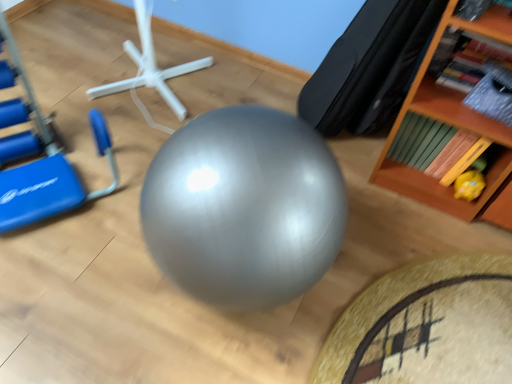
Question: From the image's perspective, is yellow rubber duck at lower right positioned above or below black leather bean bag chair at upper right?

Choices:
 (A) above
 (B) below

Answer: (B)

Question: Considering the positions of yellow rubber duck at lower right and black leather bean bag chair at upper right in the image, is yellow rubber duck at lower right wider or thinner than black leather bean bag chair at upper right?

Choices:
 (A) thin
 (B) wide

Answer: (A)

Question: Which of these objects is positioned closest to the black leather bean bag chair at upper right?

Choices:
 (A) white plastic stand at center
 (B) wooden bookshelf at upper right
 (C) blue plastic swivel chair at left
 (D) yellow rubber duck at lower right

Answer: (B)

Question: Which is farther from the yellow rubber duck at lower right?

Choices:
 (A) blue plastic swivel chair at left
 (B) white plastic stand at center
 (C) black leather bean bag chair at upper right
 (D) wooden bookshelf at upper right

Answer: (A)